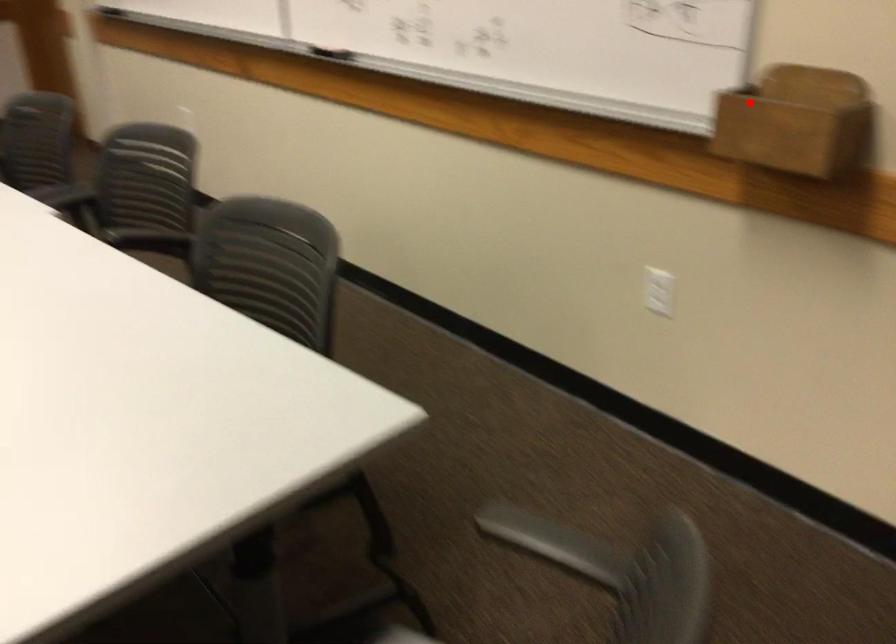
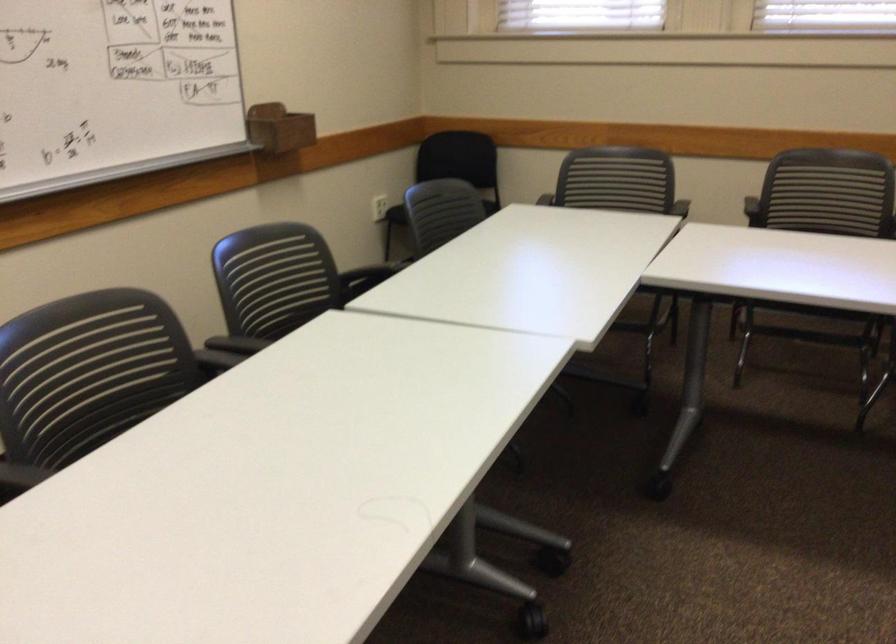
Locate, in the second image, the point that corresponds to the highlighted location in the first image.

(279, 128)